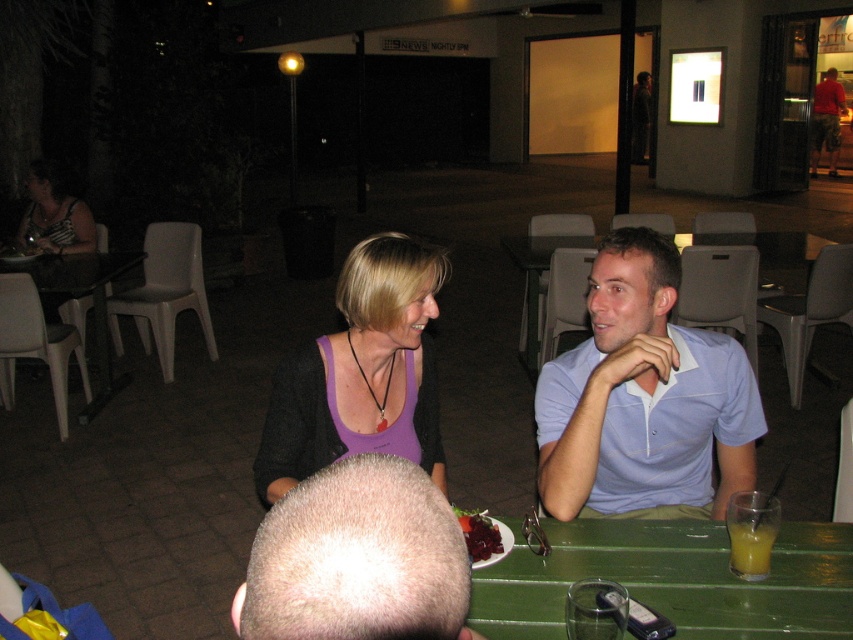
You are standing in the outdoor dining area and want to throw a napkin to the point at coordinates point (84,417). If you can throw a napkin 4 meters, will you be able to reach it?

The point (84,417) is 4.16 meters away from the viewer. Since you can throw a napkin 4 meters, you will not be able to reach it as the distance is slightly more than your throwing range.

You are a fashion designer observing the outdoor dining scene. You notice the purple fabric tank top at center and the striped fabric dress at upper left. Which clothing item is shorter in height?

The purple fabric tank top at center is not as tall as the striped fabric dress at upper left, so the purple fabric tank top at center is shorter in height.